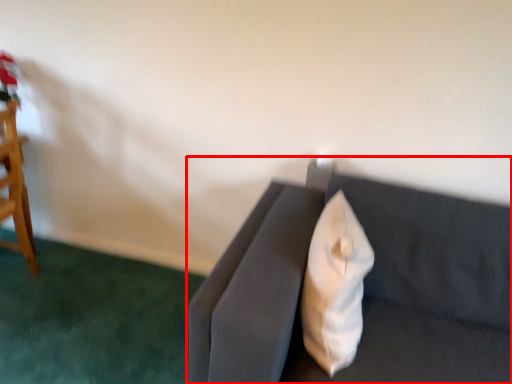
Question: From the image's perspective, where is studio couch (annotated by the red box) located in relation to throw pillow in the image?

Choices:
 (A) above
 (B) below

Answer: (B)